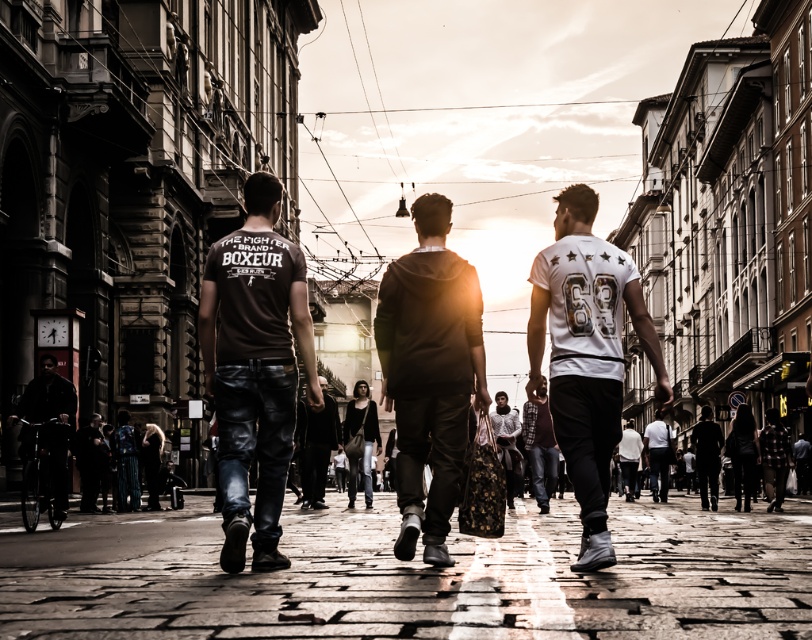
Does dark brown leather pants at center appear on the right side of dark brown leather jacket at lower left?

Yes, dark brown leather pants at center is to the right of dark brown leather jacket at lower left.

Does point (258, 262) come behind point (76, 464)?

No, it is not.

Describe the element at coordinates (255, 369) in the screenshot. The width and height of the screenshot is (812, 640). I see `dark brown leather pants at center` at that location.

This screenshot has height=640, width=812. Find the location of `dark brown leather pants at center`. dark brown leather pants at center is located at coordinates (255, 369).

Is dark matte jacket at left bigger than white textured sweater at center?

Actually, dark matte jacket at left might be smaller than white textured sweater at center.

Measure the distance between dark matte jacket at left and camera.

39.43 meters

This screenshot has height=640, width=812. I want to click on dark matte jacket at left, so click(52, 426).

Does dark brown leather pants at center appear over dark matte jacket at left?

Correct, dark brown leather pants at center is located above dark matte jacket at left.

Is point (271, 499) farther from camera compared to point (63, 424)?

No.

Where is `dark brown leather pants at center`? dark brown leather pants at center is located at coordinates (255, 369).